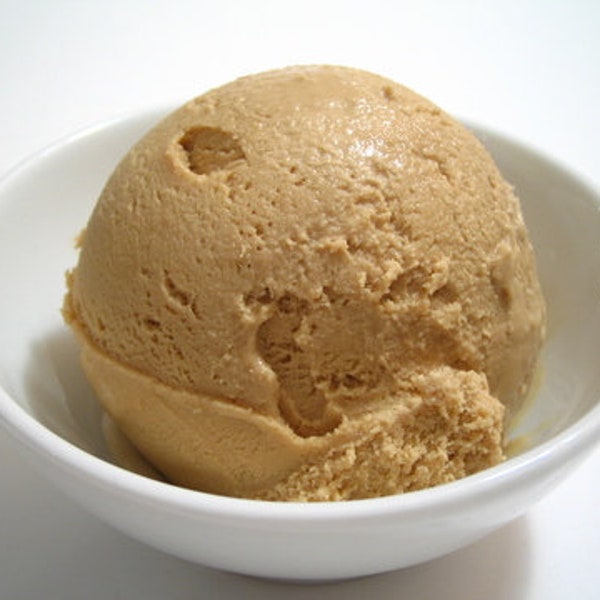
What are the coordinates of `light gray color inside bowl` in the screenshot? It's located at (34, 286).